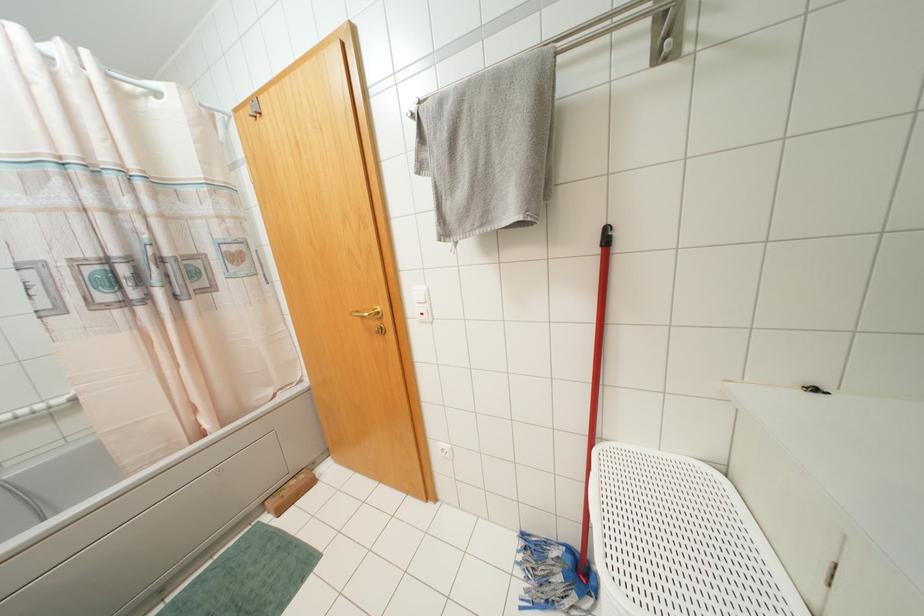
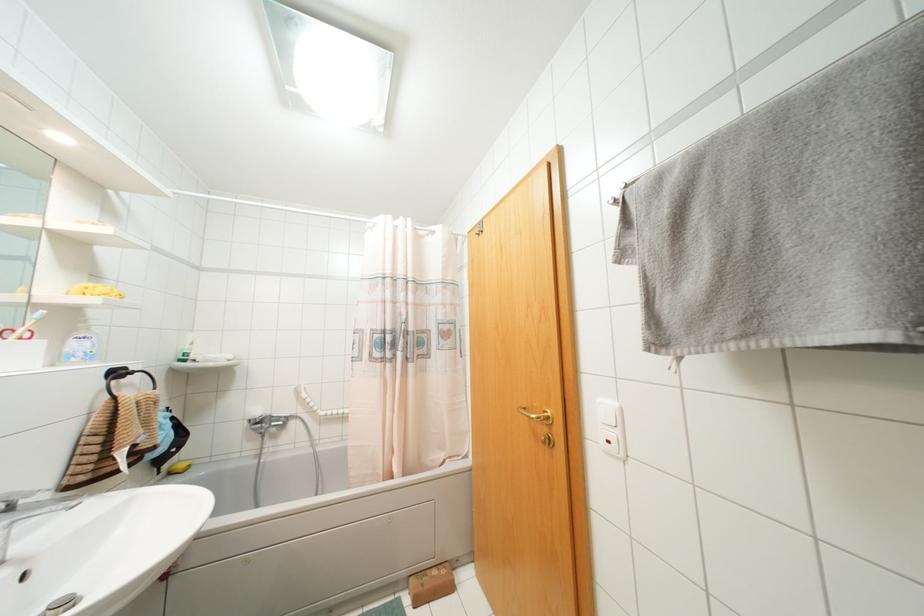
Where in the second image is the point corresponding to the point at 427,305 from the first image?

(617, 431)